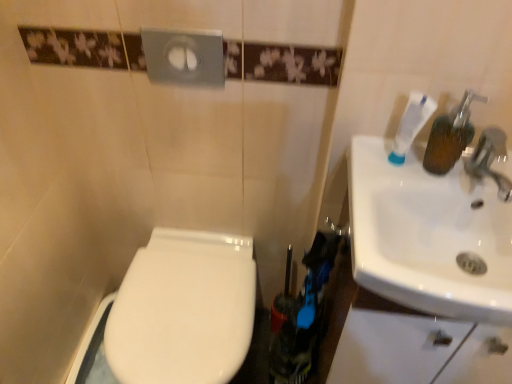
At what (x,y) coordinates should I click in order to perform the action: click on vacant space to the left of white matte toothpaste at upper right. Please return your answer as a coordinate pair (x, y). Looking at the image, I should click on (364, 169).